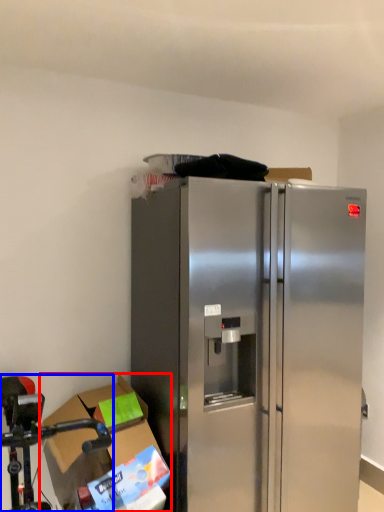
Question: Which object appears farthest to the camera in this image, cardboard box (highlighted by a red box) or stainless steel (highlighted by a blue box)?

Choices:
 (A) cardboard box
 (B) stainless steel

Answer: (A)